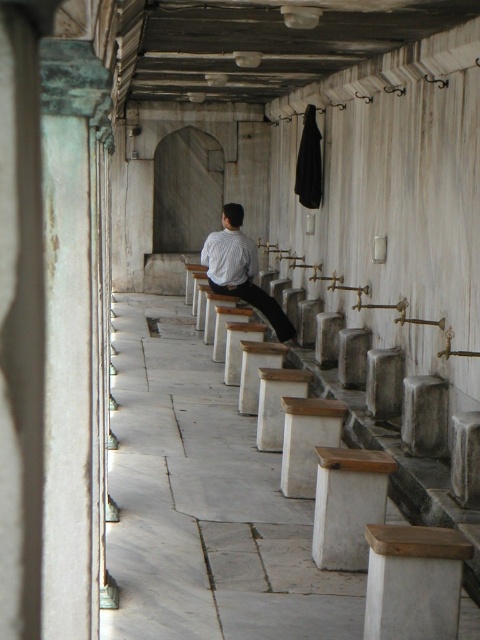
You are standing at the entrance of the corridor and see the point marked at coordinates (204, 502). What object is located at that point?

The point at coordinates (204, 502) indicates the location of the white marble bench at center.

A person is standing at the entrance of the corridor and wants to reach both the white marble bench at center and the white striped shirt at center. Which object is closer to the entrance?

The white marble bench at center and white striped shirt at center are 8.55 feet apart from each other, but their distance from the entrance is not specified in the provided information. Therefore, it is impossible to determine which is closer without additional details about their positions relative to the entrance.

You are standing at the entrance of the corridor and want to locate the white marble bench at center. According to the coordinates provided, in which direction should you walk to reach it?

The white marble bench at center is located at coordinates point (204, 502), so you should walk forward along the corridor to reach it since the bench is positioned along the central axis.